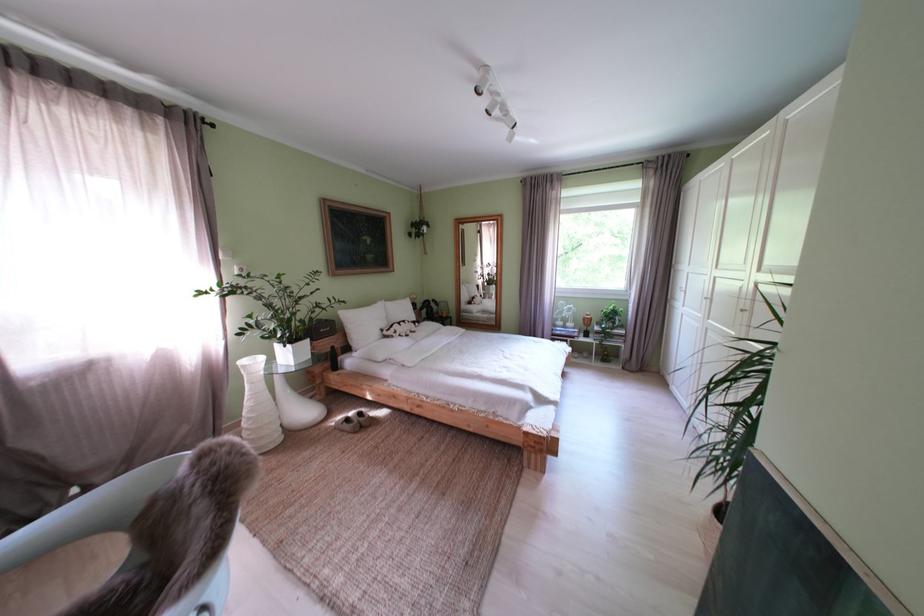
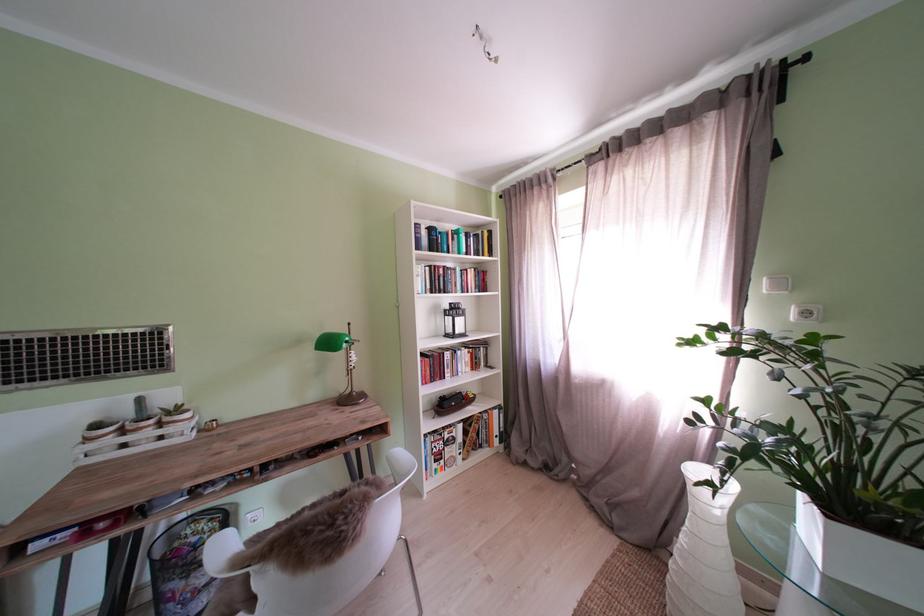
The point at (252, 275) is marked in the first image. Where is the corresponding point in the second image?

(818, 318)